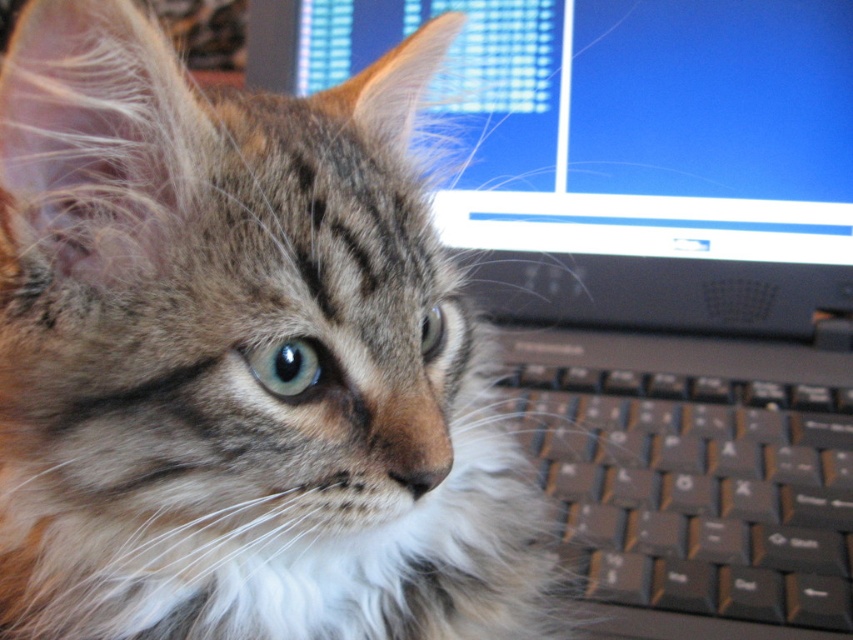
You are trying to determine if the fuzzy tabby cat at center can fit entirely on the desk where the black plastic keyboard at lower right is located. Based on their sizes, can the cat fit without overlapping the keyboard?

The fuzzy tabby cat at center is wider than the black plastic keyboard at lower right. Since the cat is wider, it might not fit entirely on the desk without overlapping the keyboard unless there is additional space available beyond the keyboard.

You are trying to figure out if the fuzzy tabby cat at center can fit entirely on the matte plastic monitor at upper center. Based on their sizes, can it?

The fuzzy tabby cat at center is narrower than the matte plastic monitor at upper center, so it can fit on the monitor.

You are a photographer trying to capture a photo of the fuzzy tabby cat at center and the black plastic keyboard at lower right. Which object is positioned closer to the left side of the frame?

The fuzzy tabby cat at center is positioned to the left of the black plastic keyboard at lower right, so it is closer to the left side of the frame.